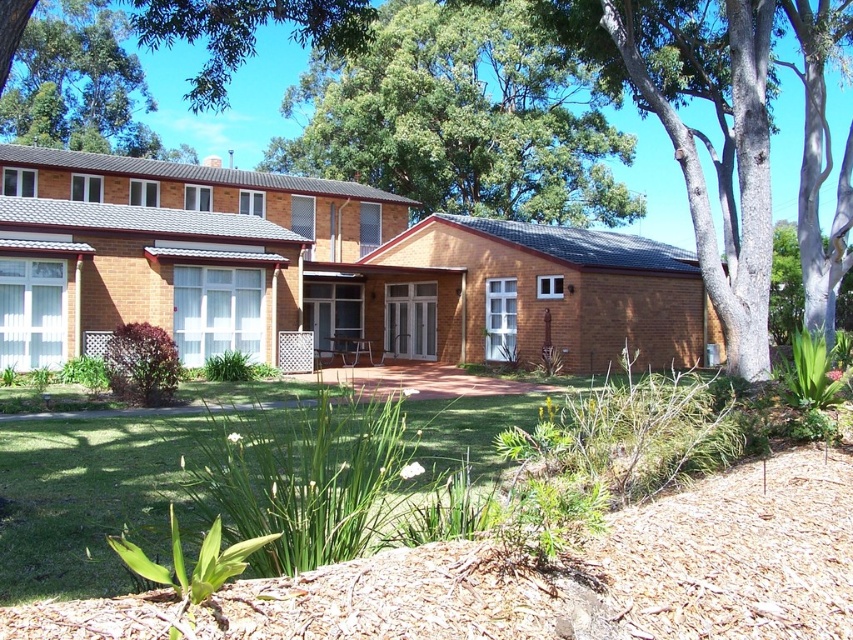
From the picture: You are standing in the garden area and want to walk from the green leafy tree at upper left to the green grass at lower left. Which direction should you move relative to the tree?

You should move to the right relative to the green leafy tree at upper left because the green grass at lower left is positioned on the right side of it.

From the picture: You are a landscape architect assessing the garden in front of the residential building. You need to determine which area has more coverage between the green grass at lower left and the green leafy tree at upper left. Which one has a larger area?

The green leafy tree at upper left has a larger area than the green grass at lower left according to the description.

In the scene shown: You are a gardener planning to plant a new tree in the garden. You notice the green leafy tree at upper center and the brown textured tree at center. Which tree is shorter and would require less space vertically?

The green leafy tree at upper center is shorter than the brown textured tree at center, so it requires less vertical space.